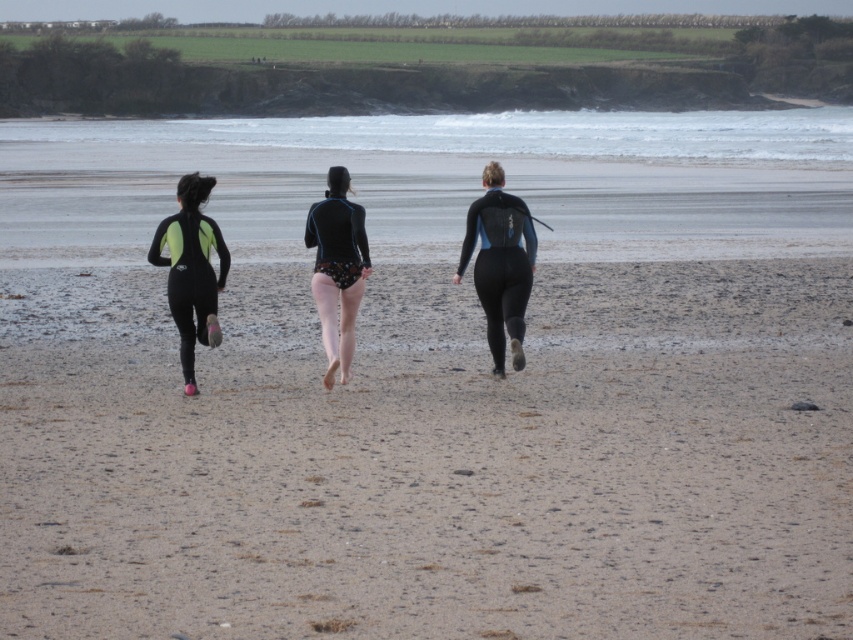
Is point (726, 406) positioned in front of point (344, 177)?

Yes, it is.

Who is more distant from viewer, (428, 289) or (316, 205)?

The point (428, 289) is behind.

The width and height of the screenshot is (853, 640). In order to click on brown sandy beach at center in this screenshot , I will do `click(432, 458)`.

Which is above, neon green neoprene wetsuit at left or black matte swimsuit at center?

black matte swimsuit at center

Who is more distant from viewer, [171,257] or [323,308]?

The point [171,257] is behind.

Between point (202, 269) and point (350, 326), which one is positioned behind?

Positioned behind is point (202, 269).

Find the location of `neon green neoprene wetsuit at left`. neon green neoprene wetsuit at left is located at coordinates coord(190,269).

Who is positioned more to the right, black matte wetsuit at center or neon green neoprene wetsuit at left?

From the viewer's perspective, black matte wetsuit at center appears more on the right side.

Is point (480, 209) farther from camera compared to point (202, 220)?

Yes, point (480, 209) is farther from viewer.

Locate an element on the screen. The width and height of the screenshot is (853, 640). black matte wetsuit at center is located at coordinates (500, 264).